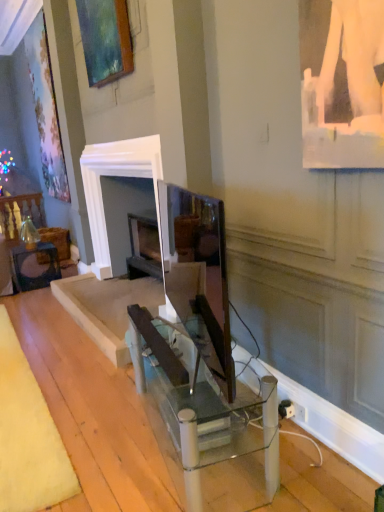
At what (x,y) coordinates should I click in order to perform the action: click on free space in front of matte glass table at lower left, the 2th table from the right. Please return your answer as a coordinate pair (x, y). This screenshot has height=512, width=384. Looking at the image, I should click on (28, 295).